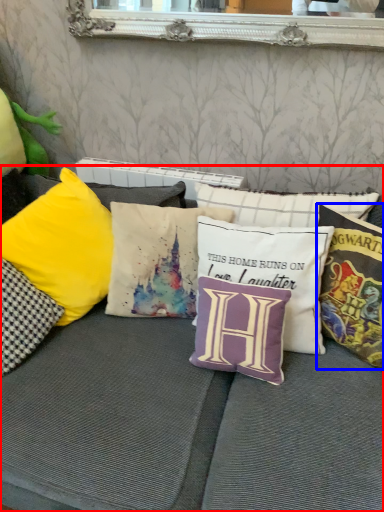
Question: Among these objects, which one is farthest to the camera, studio couch (highlighted by a red box) or pillow (highlighted by a blue box)?

Choices:
 (A) studio couch
 (B) pillow

Answer: (B)